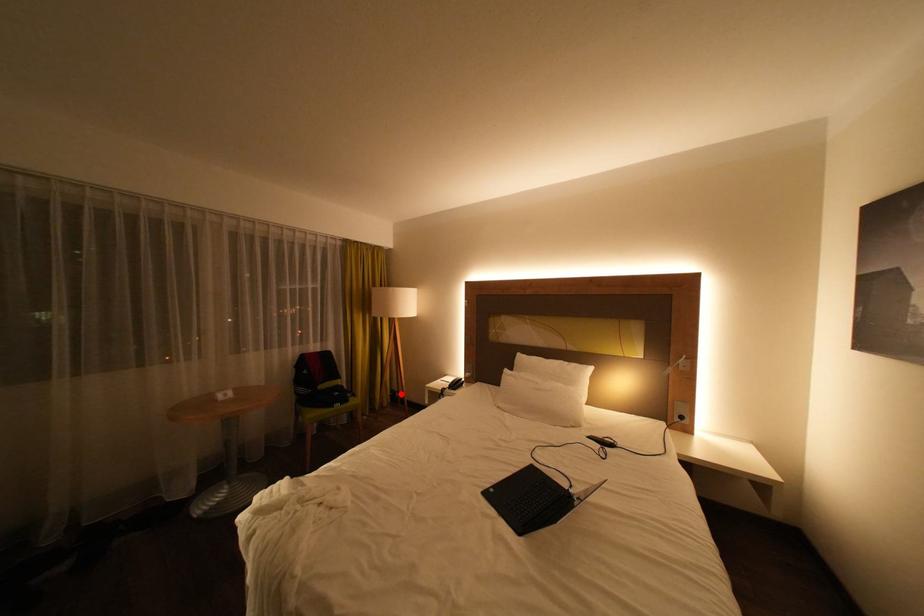
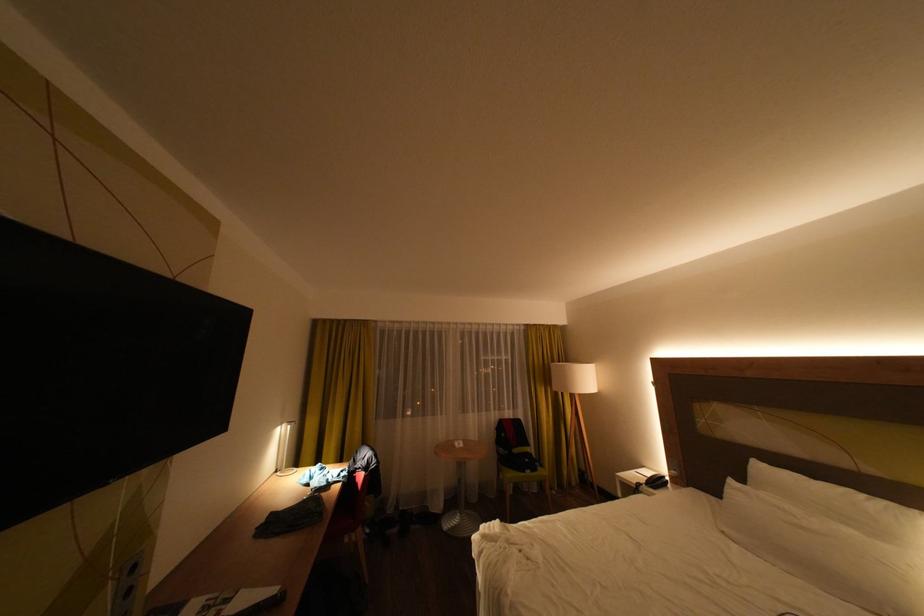
Where in the second image is the point corresponding to the highlighted location from the first image?

(590, 472)